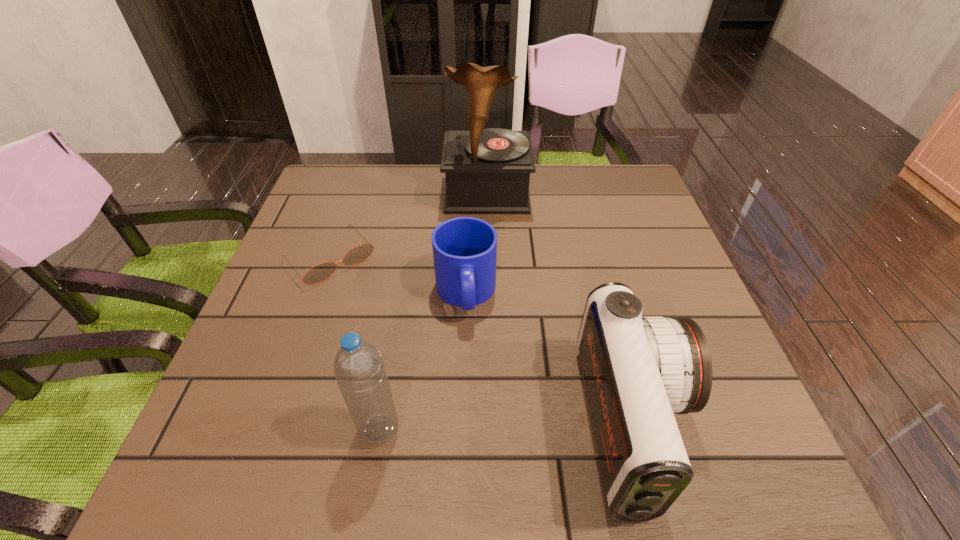
Identify which object is located as the third nearest to the fourth object from right to left. Please provide its 2D coordinates. Your answer should be formatted as a tuple, i.e. [(x, y)], where the tuple contains the x and y coordinates of a point satisfying the conditions above.

[(638, 370)]

Identify which object is the closest to the mug. Please provide its 2D coordinates. Your answer should be formatted as a tuple, i.e. [(x, y)], where the tuple contains the x and y coordinates of a point satisfying the conditions above.

[(319, 273)]

At what (x,y) coordinates should I click in order to perform the action: click on free spot that satisfies the following two spatial constraints: 1. on the front side of the farthest object; 2. on the surface of the third tallest object. Please return your answer as a coordinate pair (x, y). Looking at the image, I should click on (492, 424).

I want to click on free location that satisfies the following two spatial constraints: 1. on the back side of the farthest object; 2. on the left side of the mug, so click(x=468, y=194).

You are a GUI agent. You are given a task and a screenshot of the screen. Output one action in this format:
    pyautogui.click(x=<x>, y=<y>)
    Task: Click on the free location that satisfies the following two spatial constraints: 1. on the back side of the fourth object from right to left; 2. on the surface of the third tallest object
    
    Given the screenshot: What is the action you would take?
    pyautogui.click(x=380, y=424)

Locate an element on the screen. Image resolution: width=960 pixels, height=540 pixels. vacant area that satisfies the following two spatial constraints: 1. on the front side of the leftmost object; 2. on the right side of the second tallest object is located at coordinates [268, 430].